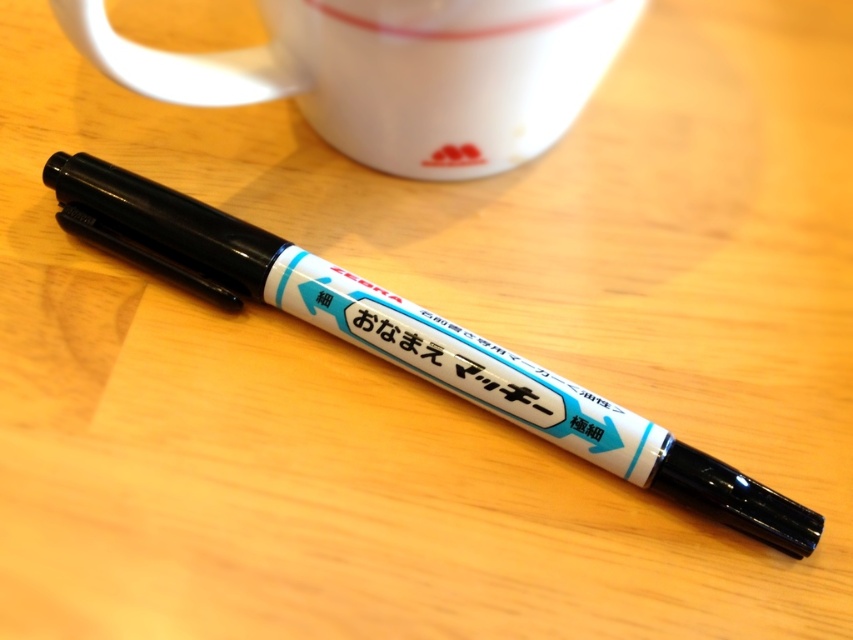
Between white matte mug at upper center and black plastic marker at center, which one appears on the left side from the viewer's perspective?

From the viewer's perspective, white matte mug at upper center appears more on the left side.

Find the location of `white matte mug at upper center`. white matte mug at upper center is located at coordinates (393, 74).

Between point (222, 72) and point (299, 314), which one is positioned in front?

Point (222, 72) is more forward.

Identify the location of white matte mug at upper center. The height and width of the screenshot is (640, 853). (393, 74).